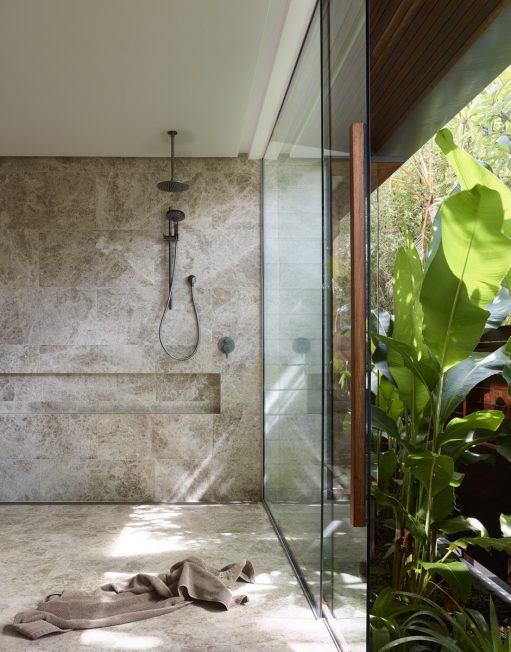
Locate an element on the screen. showerhead circular disk is located at coordinates (174, 183).